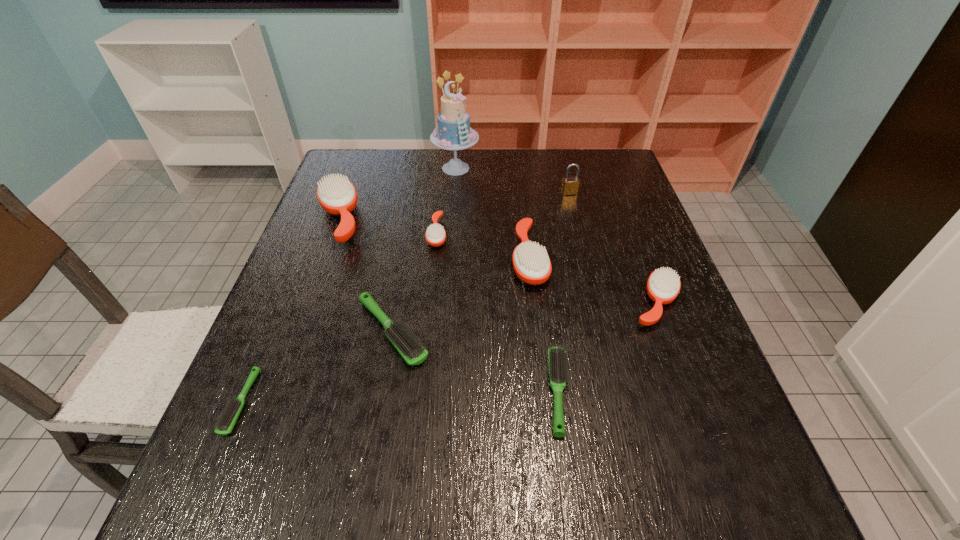
Find the location of a particular element. The height and width of the screenshot is (540, 960). free space located on the left of the fifth shortest hairbrush is located at coordinates (575, 303).

Where is `free space located on the back of the biggest light hairbrush`? free space located on the back of the biggest light hairbrush is located at coordinates (406, 253).

The image size is (960, 540). I want to click on blank space located 0.140m on the left of the second orange hairbrush from left to right, so click(x=373, y=233).

Image resolution: width=960 pixels, height=540 pixels. Identify the location of free space located on the back of the second shortest hairbrush. (547, 310).

At what (x,y) coordinates should I click in order to perform the action: click on free region located on the right of the leftmost light hairbrush. Please return your answer as a coordinate pair (x, y). Image resolution: width=960 pixels, height=540 pixels. Looking at the image, I should click on (315, 402).

Find the location of a particular element. The image size is (960, 540). cake located at the far edge is located at coordinates (453, 132).

Find the location of a particular element. padlock that is at the far edge is located at coordinates (570, 185).

This screenshot has width=960, height=540. In order to click on object located at the right edge in this screenshot , I will do `click(663, 286)`.

In order to click on free space at the far edge of the desktop in this screenshot , I will do `click(392, 158)`.

In the image, there is a desktop. In order to click on vacant space at the near edge in this screenshot , I will do `click(360, 496)`.